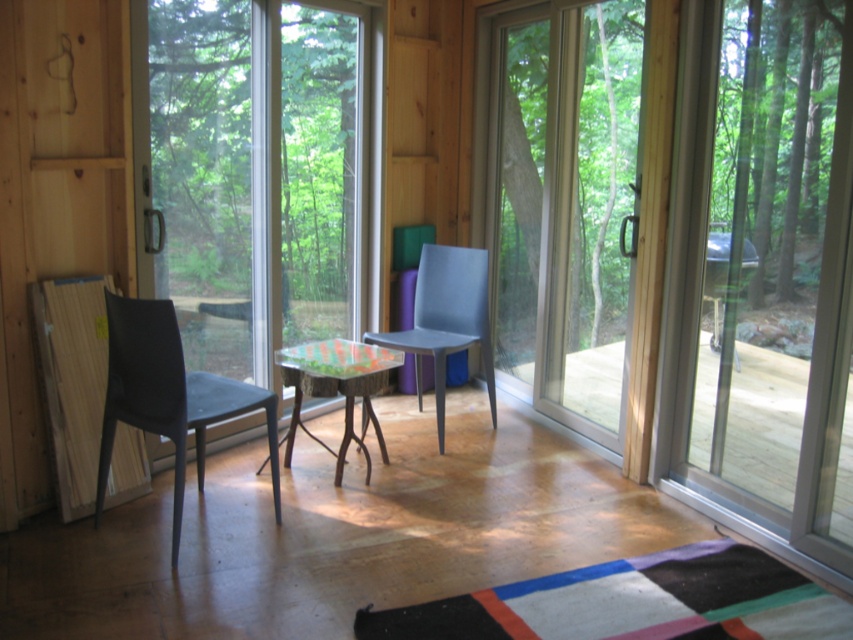
Question: Does wooden deck at lower right have a greater width compared to transparent glass screen door at right?

Choices:
 (A) yes
 (B) no

Answer: (A)

Question: Does wooden deck at lower right appear on the right side of translucent glass table at center?

Choices:
 (A) no
 (B) yes

Answer: (B)

Question: Which of these objects is positioned farthest from the matte black chair at left?

Choices:
 (A) transparent glass screen door at right
 (B) transparent glass window at left
 (C) translucent glass table at center

Answer: (A)

Question: Where is transparent glass window at left located in relation to matte black chair at left in the image?

Choices:
 (A) right
 (B) left

Answer: (A)

Question: Considering the real-world distances, which object is closest to the matte blue chair at center?

Choices:
 (A) transparent glass screen door at right
 (B) translucent glass table at center

Answer: (B)

Question: Which of these objects is positioned closest to the transparent glass window at left?

Choices:
 (A) matte blue chair at center
 (B) wooden deck at lower right

Answer: (A)